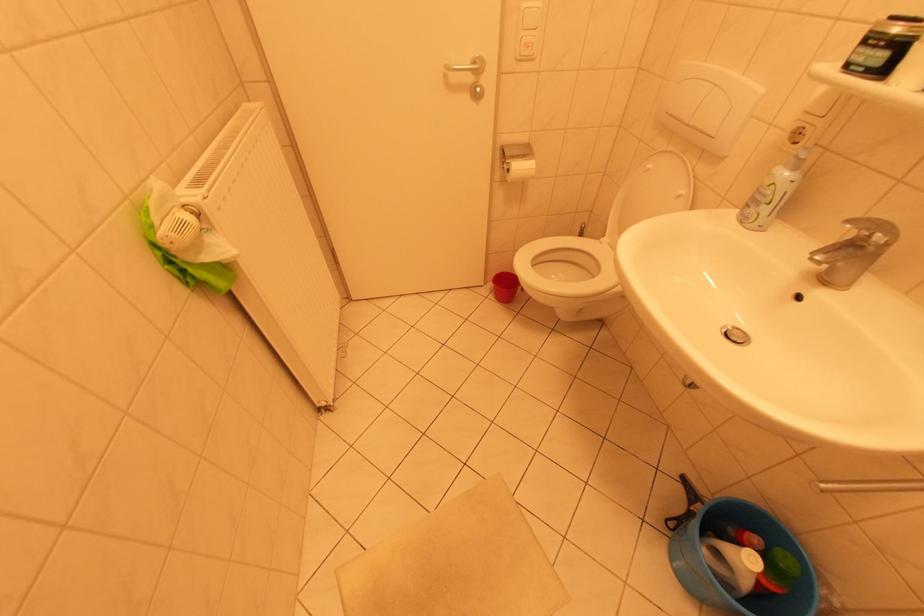
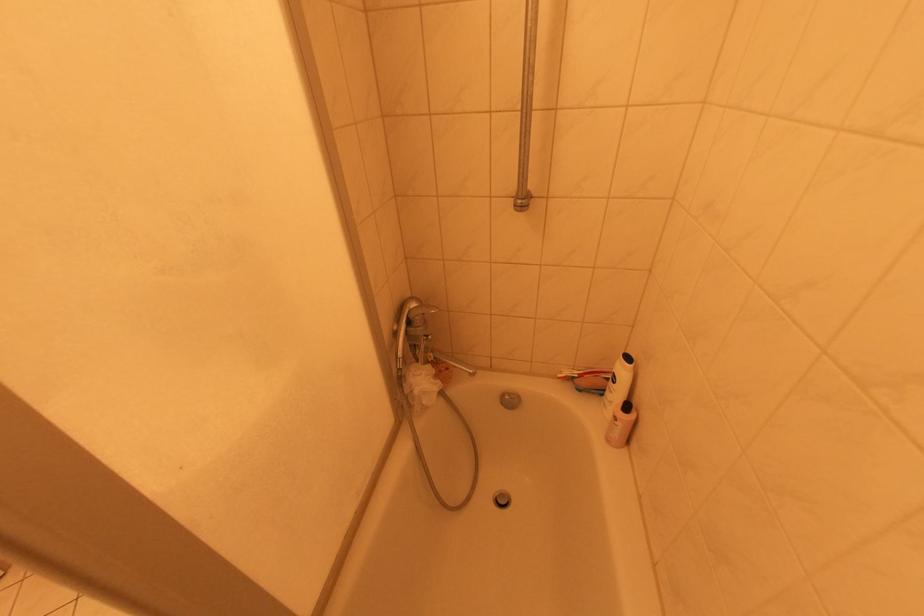
Question: Based on the continuous images, in which direction is the camera rotating? Reply with the corresponding letter.

Choices:
 (A) Left
 (B) Right
 (C) Up
 (D) Down

Answer: (B)